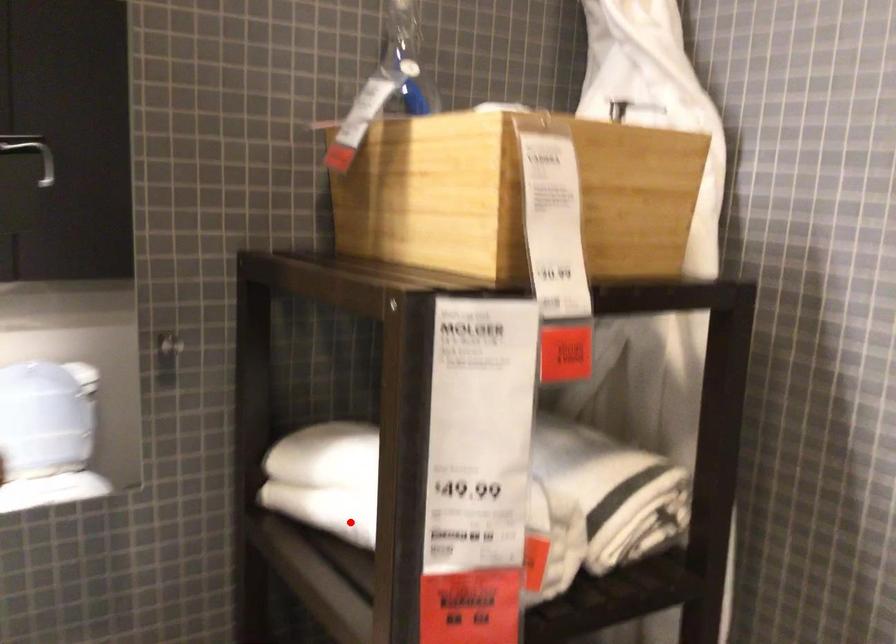
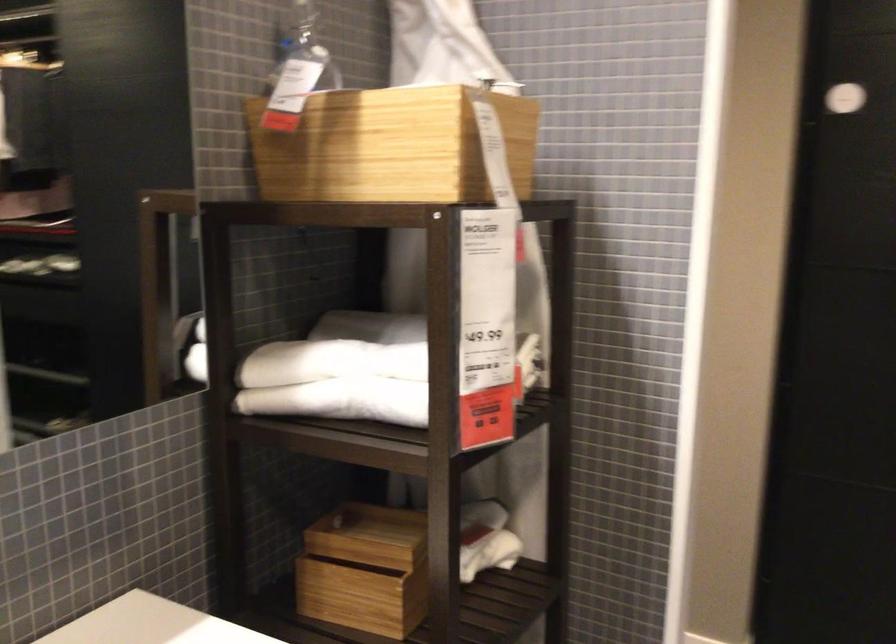
Question: I am providing you with two images of the same scene from different viewpoints. Image1 has a red point marked. In image2, the corresponding 3D location appears at what relative position? Reply with the corresponding letter.

Choices:
 (A) Closer
 (B) Farther

Answer: (B)